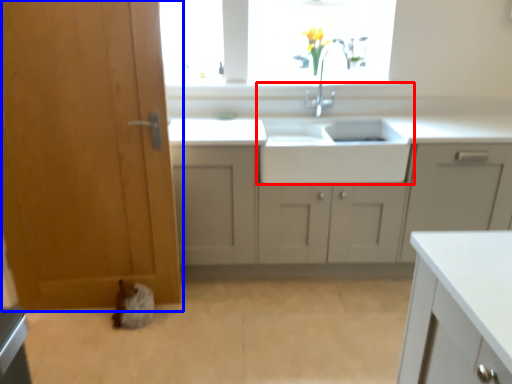
Question: Which object is closer to the camera taking this photo, sink (highlighted by a red box) or door (highlighted by a blue box)?

Choices:
 (A) sink
 (B) door

Answer: (B)